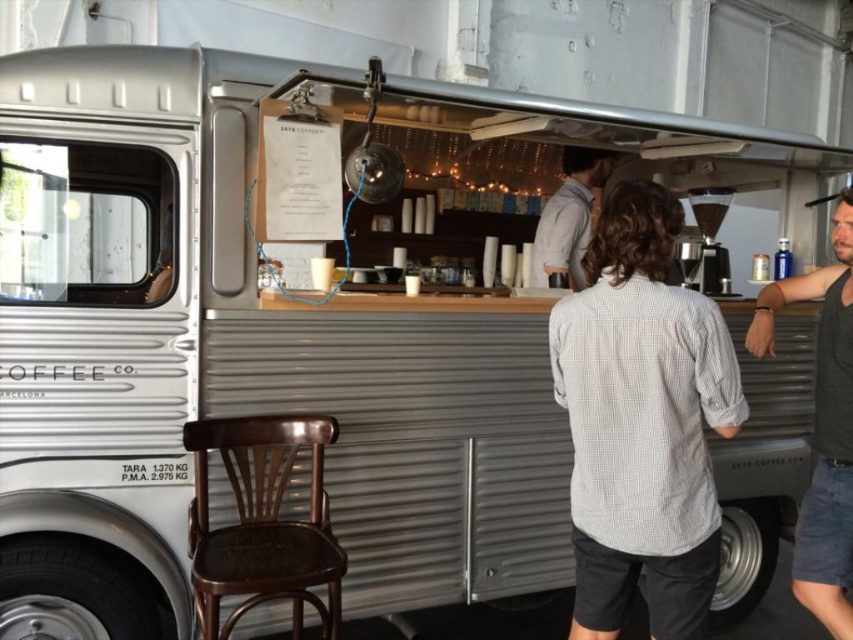
Question: Which of the following is the closest to the observer?

Choices:
 (A) gray cotton shirt at center
 (B) dark gray tank top at right
 (C) mahogany wood bar stool at lower left
 (D) white checkered shirt at center

Answer: (D)

Question: Which is nearer to the mahogany wood bar stool at lower left?

Choices:
 (A) white checkered shirt at center
 (B) dark gray tank top at right
 (C) gray cotton shirt at center

Answer: (A)

Question: Does white checkered shirt at center have a lesser width compared to dark gray tank top at right?

Choices:
 (A) yes
 (B) no

Answer: (B)

Question: Can you confirm if mahogany wood bar stool at lower left is positioned to the left of gray cotton shirt at center?

Choices:
 (A) no
 (B) yes

Answer: (B)

Question: Is white checkered shirt at center smaller than dark gray tank top at right?

Choices:
 (A) no
 (B) yes

Answer: (A)

Question: Which point appears farthest from the camera in this image?

Choices:
 (A) (631, 316)
 (B) (231, 552)

Answer: (B)